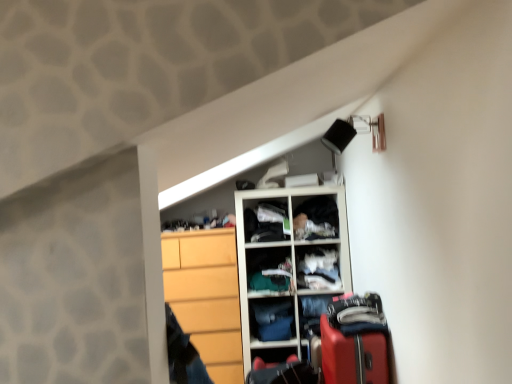
Question: Which direction should I rotate to look at dark gray fabric at upper center, which is counted as the 2th clothing, starting from the bottom?

Choices:
 (A) left
 (B) right

Answer: (B)

Question: Does white wooden cupboard at center appear on the right side of dark blue fabric at center?

Choices:
 (A) yes
 (B) no

Answer: (A)

Question: Is white wooden cupboard at center closer to the viewer compared to dark blue fabric at center?

Choices:
 (A) no
 (B) yes

Answer: (B)

Question: Could you tell me if white wooden cupboard at center is facing dark blue fabric at center?

Choices:
 (A) no
 (B) yes

Answer: (B)

Question: From the image's perspective, is white wooden cupboard at center on top of dark blue fabric at center?

Choices:
 (A) yes
 (B) no

Answer: (B)

Question: Can you confirm if white wooden cupboard at center is smaller than dark blue fabric at center?

Choices:
 (A) yes
 (B) no

Answer: (B)

Question: Does white wooden cupboard at center have a lesser height compared to dark blue fabric at center?

Choices:
 (A) no
 (B) yes

Answer: (A)

Question: From the image's perspective, does white fabric at center, arranged as the 1th cabinet when ordered from the bottom, appear lower than matte black suitcase at lower right, which is the 2th luggage in top-to-bottom order?

Choices:
 (A) no
 (B) yes

Answer: (A)

Question: Is white fabric at center, arranged as the 1th cabinet when ordered from the bottom, outside of matte black suitcase at lower right, arranged as the second luggage when viewed from the front?

Choices:
 (A) no
 (B) yes

Answer: (B)

Question: Are white fabric at center, the 1th cabinet when ordered from right to left, and matte black suitcase at lower right, the second luggage from the right, located far from each other?

Choices:
 (A) no
 (B) yes

Answer: (A)

Question: Considering the relative sizes of white fabric at center, the 2th cabinet in the left-to-right sequence, and matte black suitcase at lower right, the second luggage from the right, in the image provided, is white fabric at center, the 2th cabinet in the left-to-right sequence, taller than matte black suitcase at lower right, the second luggage from the right,?

Choices:
 (A) no
 (B) yes

Answer: (B)

Question: Does white fabric at center, the 2th cabinet in the left-to-right sequence, have a lesser height compared to matte black suitcase at lower right, which is the 2th luggage in top-to-bottom order?

Choices:
 (A) no
 (B) yes

Answer: (A)

Question: Is white fabric at center, the 1th cabinet when ordered from right to left, positioned behind matte black suitcase at lower right, arranged as the second luggage when viewed from the front?

Choices:
 (A) no
 (B) yes

Answer: (B)

Question: From a real-world perspective, is white plastic cabinet at upper center, the second cabinet viewed from the right, on top of matte black suitcase at lower right, arranged as the second luggage when viewed from the front?

Choices:
 (A) no
 (B) yes

Answer: (B)